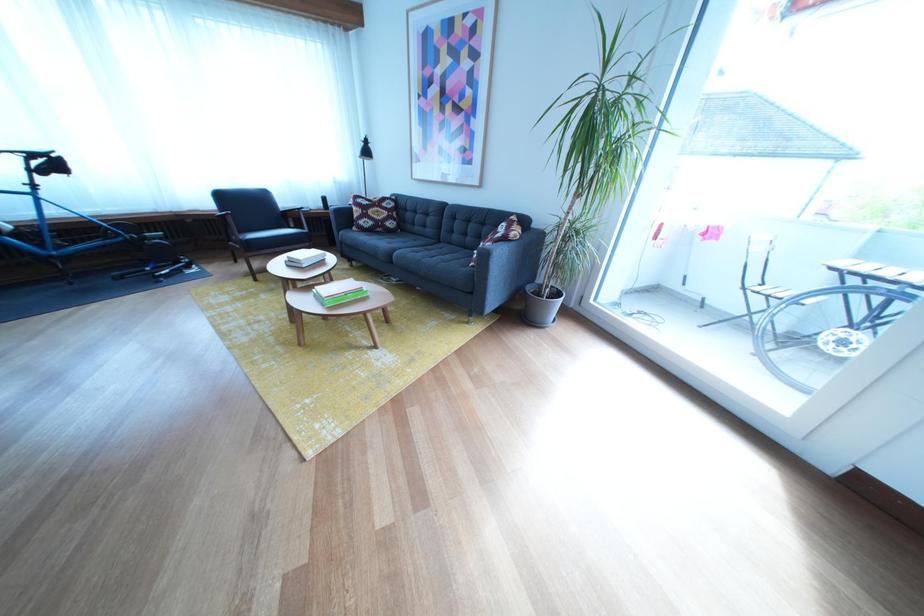
Where would you sit the black chair sitting surface? Please return your answer as a coordinate pair (x, y).

(264, 238)